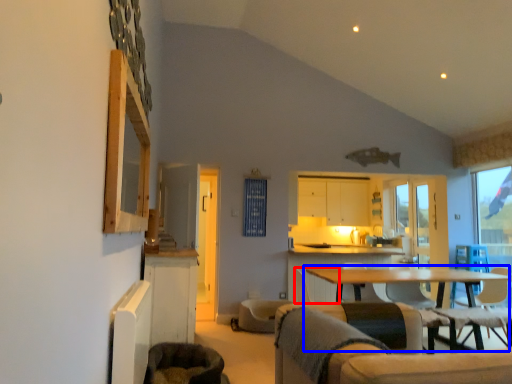
Question: Among these objects, which one is farthest to the camera, armchair (highlighted by a red box) or table (highlighted by a blue box)?

Choices:
 (A) armchair
 (B) table

Answer: (A)